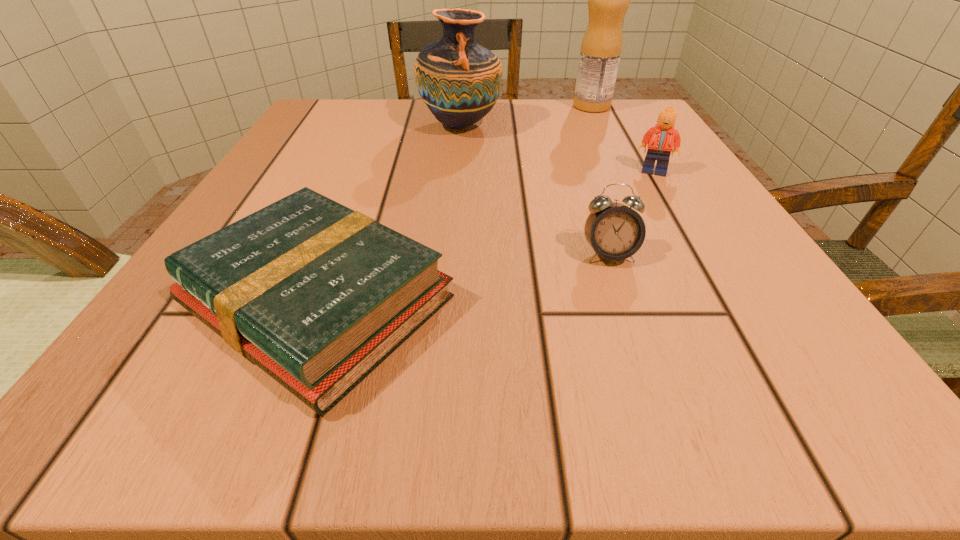
Where is `the tallest object`? Image resolution: width=960 pixels, height=540 pixels. the tallest object is located at coordinates (608, 0).

Where is `the second tallest object`? The image size is (960, 540). the second tallest object is located at coordinates (459, 80).

Image resolution: width=960 pixels, height=540 pixels. Identify the location of the third nearest object. (660, 138).

Identify the location of the second shortest object. (615, 231).

Identify the location of the shortest object. (317, 295).

This screenshot has height=540, width=960. What are the coordinates of `vacant space located on the front label of the tallest object` in the screenshot? It's located at (412, 106).

You are a GUI agent. You are given a task and a screenshot of the screen. Output one action in this format:
    pyautogui.click(x=<x>, y=<y>)
    Task: Click on the free spot located on the front label of the tallest object
    
    Given the screenshot: What is the action you would take?
    pyautogui.click(x=515, y=106)

Identify the location of blank space located on the front label of the tallest object. (430, 106).

Where is `vacant area situated 0.300m on the right of the fourth shortest object`? This screenshot has width=960, height=540. vacant area situated 0.300m on the right of the fourth shortest object is located at coordinates (646, 125).

At what (x,y) coordinates should I click in order to perform the action: click on vacant position located on the front-facing side of the Lego. Please return your answer as a coordinate pair (x, y). The image size is (960, 540). Looking at the image, I should click on (758, 348).